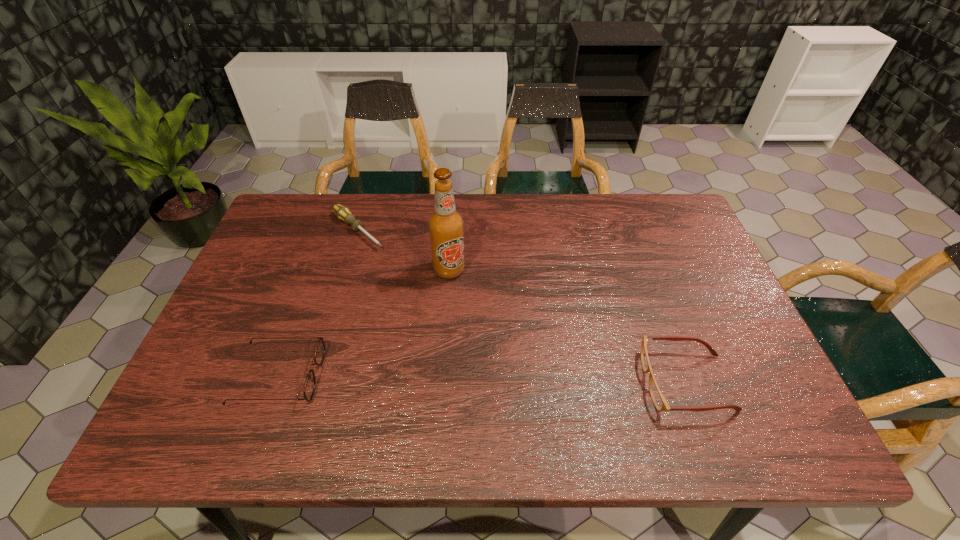
I want to click on free space on the desktop that is between the sunglasses and the spectacles and is positioned at the tip of the farthest object, so click(x=530, y=380).

Identify the location of free spot on the desktop that is between the sunglasses and the rightmost object and is positioned on the front label of the beer bottle. (480, 379).